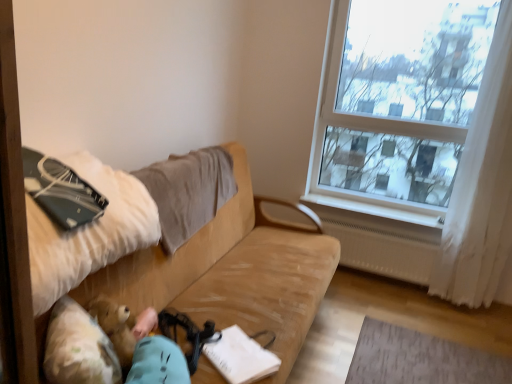
Question: Can you confirm if matte black notebook at left is wider than beige fabric pillow at upper left?

Choices:
 (A) no
 (B) yes

Answer: (B)

Question: From the image's perspective, is matte black notebook at left under beige fabric pillow at upper left?

Choices:
 (A) no
 (B) yes

Answer: (A)

Question: Is matte black notebook at left beside beige fabric pillow at upper left?

Choices:
 (A) yes
 (B) no

Answer: (B)

Question: Considering the relative positions of matte black notebook at left and beige fabric pillow at upper left in the image provided, is matte black notebook at left behind beige fabric pillow at upper left?

Choices:
 (A) no
 (B) yes

Answer: (A)

Question: Is matte black notebook at left taller than beige fabric pillow at upper left?

Choices:
 (A) yes
 (B) no

Answer: (B)

Question: Is beige fabric pillow at upper left to the left or to the right of fluffy beige teddy bear at lower left in the image?

Choices:
 (A) left
 (B) right

Answer: (B)

Question: From a real-world perspective, is beige fabric pillow at upper left positioned above or below fluffy beige teddy bear at lower left?

Choices:
 (A) below
 (B) above

Answer: (B)

Question: Is point (224, 153) positioned closer to the camera than point (81, 354)?

Choices:
 (A) closer
 (B) farther

Answer: (B)

Question: In the image, is beige fabric pillow at upper left positioned in front of or behind fluffy beige teddy bear at lower left?

Choices:
 (A) behind
 (B) front

Answer: (A)

Question: From the image's perspective, is beige fabric pillow at upper left located above or below white plastic radiator at lower right?

Choices:
 (A) below
 (B) above

Answer: (B)

Question: In the image, is beige fabric pillow at upper left positioned in front of or behind white plastic radiator at lower right?

Choices:
 (A) behind
 (B) front

Answer: (B)

Question: Does point (178, 215) appear closer or farther from the camera than point (325, 213)?

Choices:
 (A) farther
 (B) closer

Answer: (B)

Question: From a real-world perspective, is beige fabric pillow at upper left positioned above or below white plastic radiator at lower right?

Choices:
 (A) above
 (B) below

Answer: (A)

Question: From a real-world perspective, is transparent glass window at upper right positioned above or below beige fabric pillow at upper left?

Choices:
 (A) above
 (B) below

Answer: (A)

Question: In the image, is transparent glass window at upper right on the left side or the right side of beige fabric pillow at upper left?

Choices:
 (A) right
 (B) left

Answer: (A)